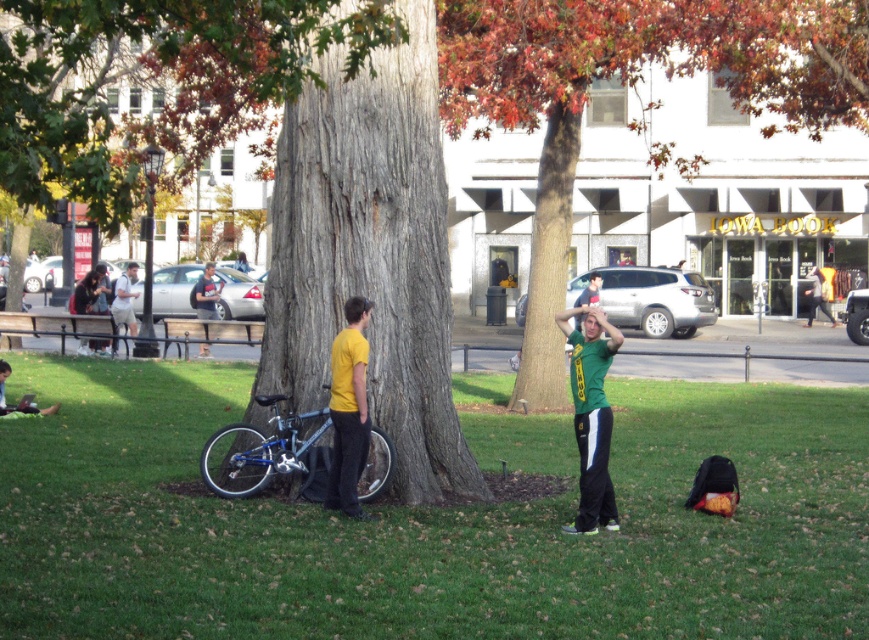
You are standing in an autumn park scene. You see a gray textured tree trunk at center and a green matte shirt at center. Which object is positioned higher relative to the other?

The gray textured tree trunk at center is located above the green matte shirt at center, so it is positioned higher.